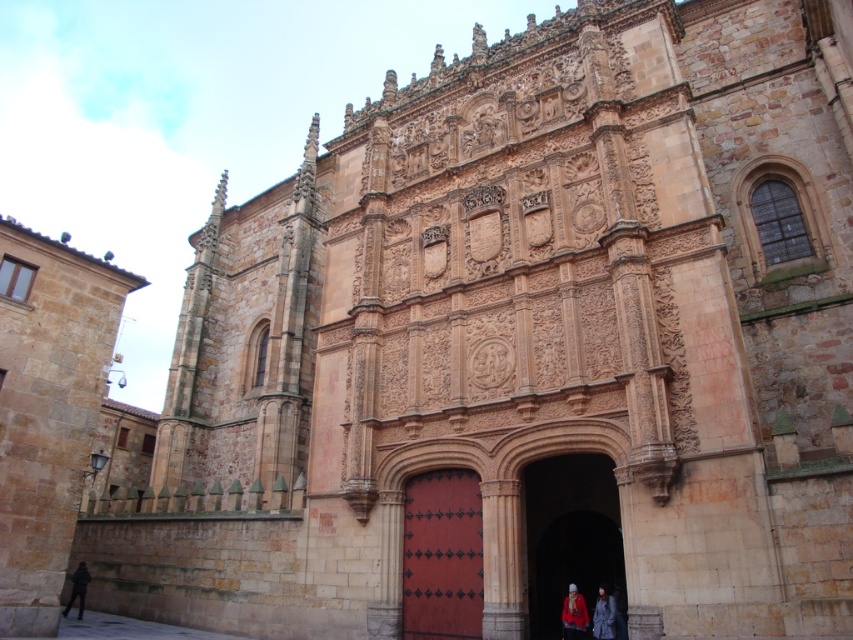
You are standing in front of the grand historic building and want to locate the smooth stone archway at center. According to the coordinates provided, where should you look? Please specify the coordinates in the format of point followed by numbers.

You should look at point (569,534) to find the smooth stone archway at center.

You are an architect visiting the building and want to know the spatial relationship between the smooth stone archway at center and the smooth red wood door at center. Which one is above the other?

The smooth stone archway at center is positioned over the smooth red wood door at center, meaning the archway is above the door.

You are standing in front of the historic building and notice two points marked on the facade. The first point is at coordinates point (567, 600) and the second is at point (71, 586). Which of these two points is closer to your current position?

Point (567, 600) is closer to the camera than point (71, 586), so the first point is closer to your current position.